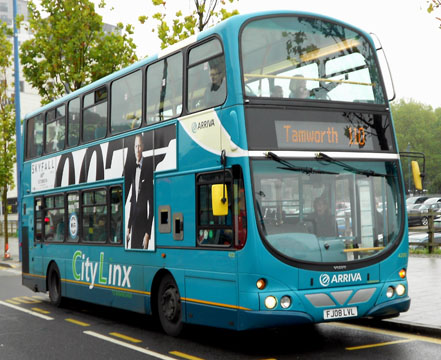
The width and height of the screenshot is (441, 360). Find the location of `lights`. lights is located at coordinates (267, 301).